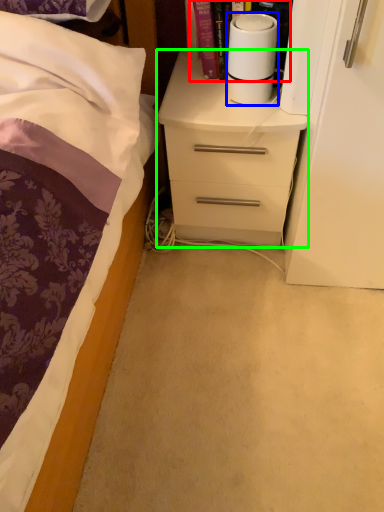
Question: Which object is positioned closest to book (highlighted by a red box)? Select from paper towel (highlighted by a blue box) and chest of drawers (highlighted by a green box).

Choices:
 (A) paper towel
 (B) chest of drawers

Answer: (A)